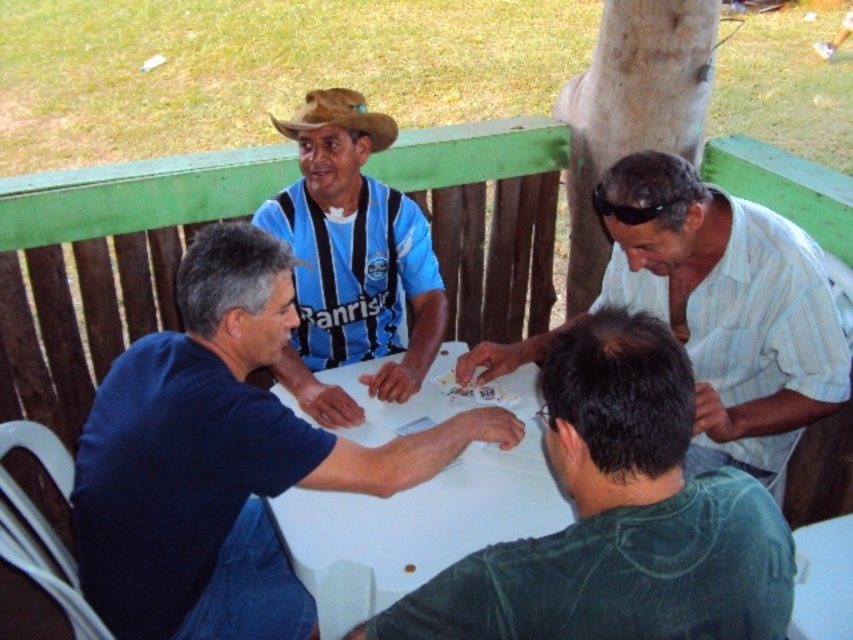
Question: Which point is closer to the camera taking this photo?

Choices:
 (A) (715, 476)
 (B) (730, 282)
 (C) (383, 440)
 (D) (260, 518)

Answer: (A)

Question: Is dark green denim shirt at lower right thinner than brown woven cowboy hat at center?

Choices:
 (A) no
 (B) yes

Answer: (A)

Question: Where is dark green denim shirt at lower right located in relation to white glossy table at center in the image?

Choices:
 (A) right
 (B) left

Answer: (A)

Question: Can you confirm if white glossy table at center is bigger than brown woven cowboy hat at center?

Choices:
 (A) no
 (B) yes

Answer: (B)

Question: Which object is the farthest from the white striped shirt at upper right?

Choices:
 (A) brown woven cowboy hat at center
 (B) dark green denim shirt at lower right

Answer: (A)

Question: Which of the following is the farthest from the observer?

Choices:
 (A) brown woven cowboy hat at center
 (B) white striped shirt at upper right
 (C) blue cotton shirt at left

Answer: (A)